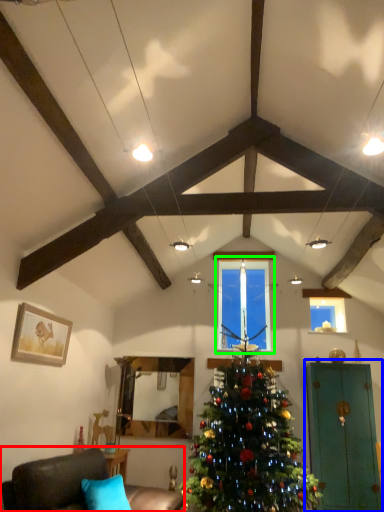
Question: Which object is the farthest from studio couch (highlighted by a red box)? Choose among these: armoire (highlighted by a blue box) or window (highlighted by a green box).

Choices:
 (A) armoire
 (B) window

Answer: (A)